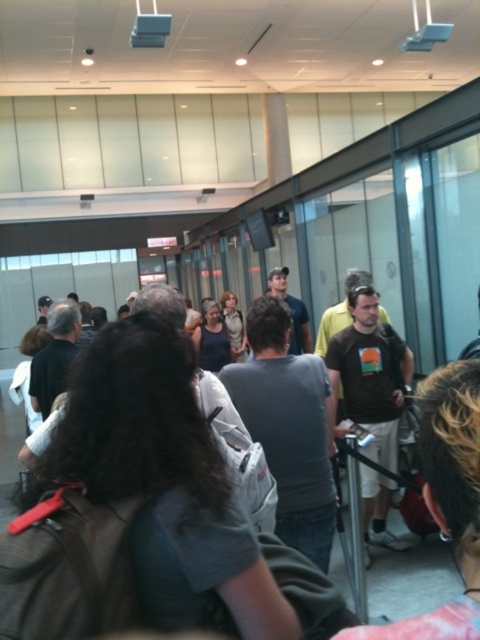
You are a person trying to find space to sit down in the waiting area. You see a dark gray fabric backpack at center and a light brown leather jacket at center. Which item takes up less space so you can move it aside?

The dark gray fabric backpack at center has a smaller size compared to the light brown leather jacket at center, so it takes up less space and can be moved aside more easily.